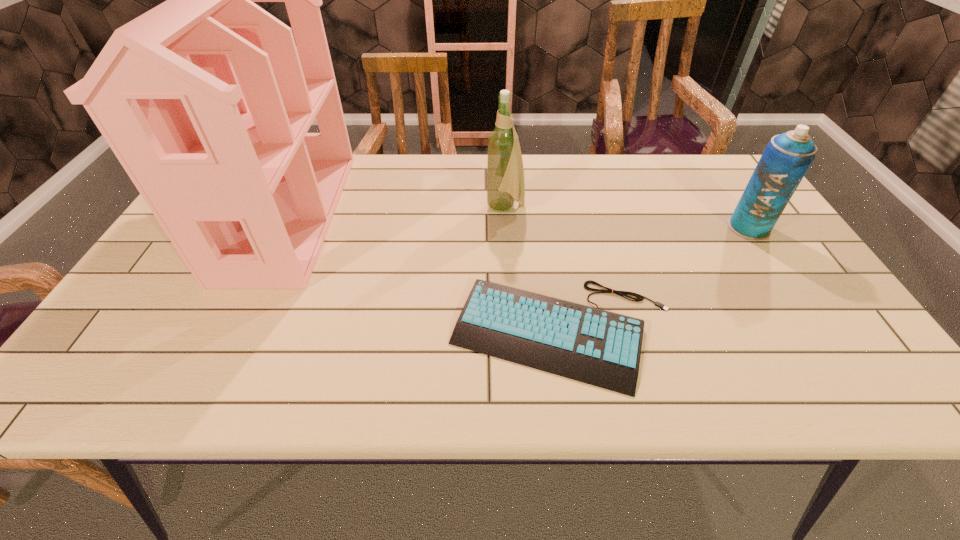
In the image, there is a desktop. Where is `vacant space at the right edge`? This screenshot has width=960, height=540. vacant space at the right edge is located at coordinates (810, 313).

Locate an element on the screen. The width and height of the screenshot is (960, 540). free space at the near right corner of the desktop is located at coordinates (825, 375).

Locate an element on the screen. The width and height of the screenshot is (960, 540). empty space between the second shortest object and the wine bottle is located at coordinates (627, 218).

Where is `free space between the leftmost object and the shortest object`? The width and height of the screenshot is (960, 540). free space between the leftmost object and the shortest object is located at coordinates (426, 274).

Identify the location of vacant space that is in between the computer keyboard and the wine bottle. (535, 271).

Locate an element on the screen. Image resolution: width=960 pixels, height=540 pixels. empty space that is in between the wine bottle and the shortest object is located at coordinates (535, 271).

At what (x,y) coordinates should I click in order to perform the action: click on vacant area between the aerosol can and the leftmost object. Please return your answer as a coordinate pair (x, y). This screenshot has width=960, height=540. Looking at the image, I should click on (519, 221).

Where is `free space between the dollhouse and the wine bottle`? free space between the dollhouse and the wine bottle is located at coordinates (397, 212).

Image resolution: width=960 pixels, height=540 pixels. What are the coordinates of `empty space between the aerosol can and the wine bottle` in the screenshot? It's located at (627, 218).

The width and height of the screenshot is (960, 540). Identify the location of vacant area that lies between the computer keyboard and the second shortest object. (656, 280).